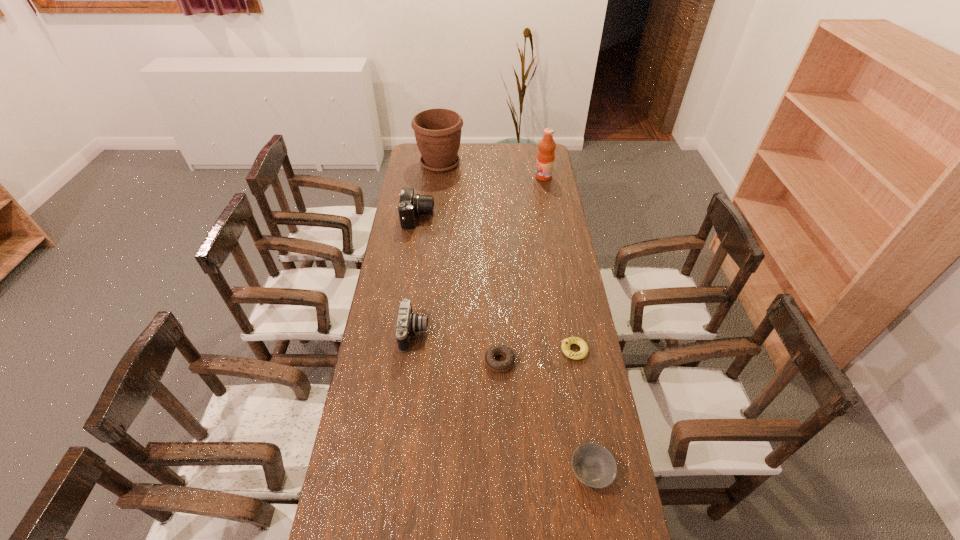
At what (x,y) coordinates should I click in order to perform the action: click on vacant space at the far right corner of the desktop. Please return your answer as a coordinate pair (x, y). This screenshot has width=960, height=540. Looking at the image, I should click on (522, 154).

Where is `free point between the flowerpot and the fruit juice`? This screenshot has width=960, height=540. free point between the flowerpot and the fruit juice is located at coordinates (492, 170).

The height and width of the screenshot is (540, 960). Identify the location of vacant area that lies between the duckling and the fruit juice. (559, 264).

Identify the location of vacant area that lies between the third shortest object and the shortest object. The height and width of the screenshot is (540, 960). (537, 355).

The image size is (960, 540). I want to click on unoccupied position between the flowerpot and the farther camera, so click(x=429, y=191).

You are a GUI agent. You are given a task and a screenshot of the screen. Output one action in this format:
    pyautogui.click(x=<x>, y=<y>)
    Task: Click on the free space between the fifth tallest object and the nearer camera
    
    Given the screenshot: What is the action you would take?
    pyautogui.click(x=494, y=341)

Find the location of `free space between the nearer camera and the bowl`. free space between the nearer camera and the bowl is located at coordinates point(503,402).

You are a GUI agent. You are given a task and a screenshot of the screen. Output one action in this format:
    pyautogui.click(x=<x>, y=<y>)
    Task: Click on the free spot between the fifth tallest object and the fruit juice
    The image size is (960, 540).
    Given the screenshot: What is the action you would take?
    pyautogui.click(x=559, y=264)

The height and width of the screenshot is (540, 960). I want to click on vacant area that lies between the fruit juice and the fourth object from right to left, so click(x=521, y=269).

The width and height of the screenshot is (960, 540). Identify the location of vacant region between the nearer camera and the nearest object. (503, 402).